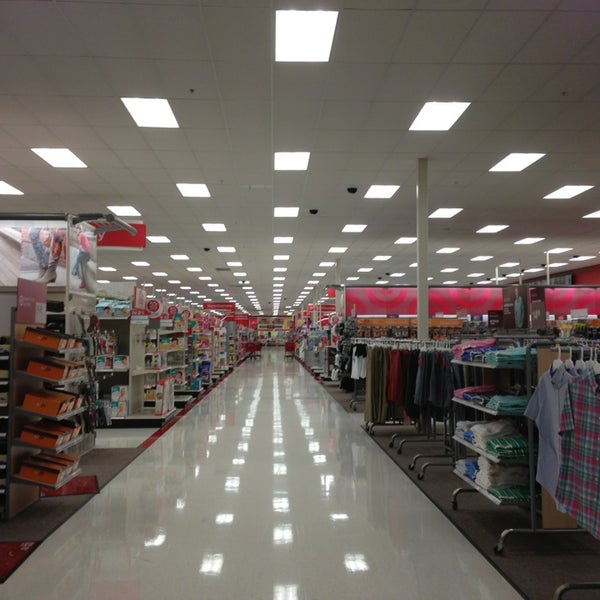
Find the location of a particular element. The width and height of the screenshot is (600, 600). inside view of department store is located at coordinates (269, 357).